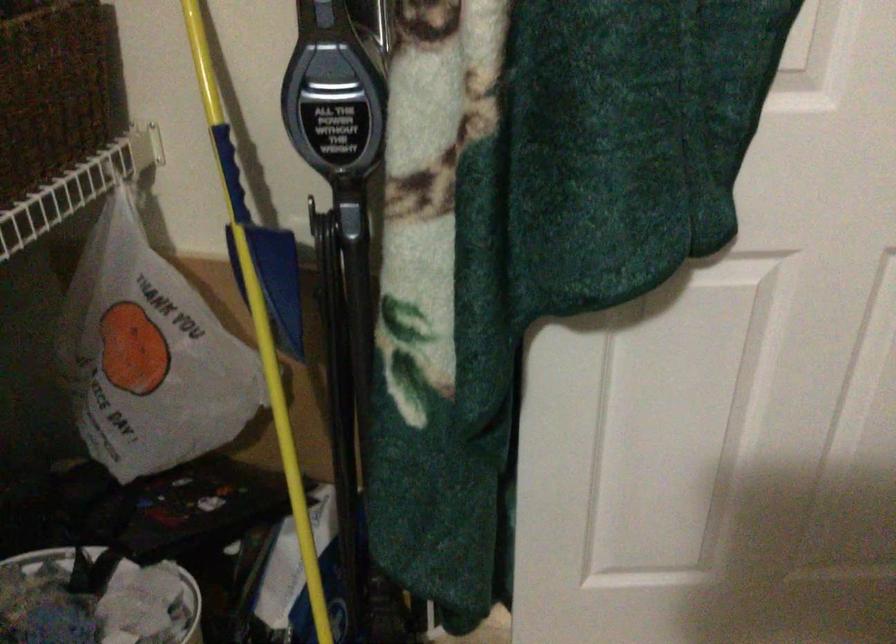
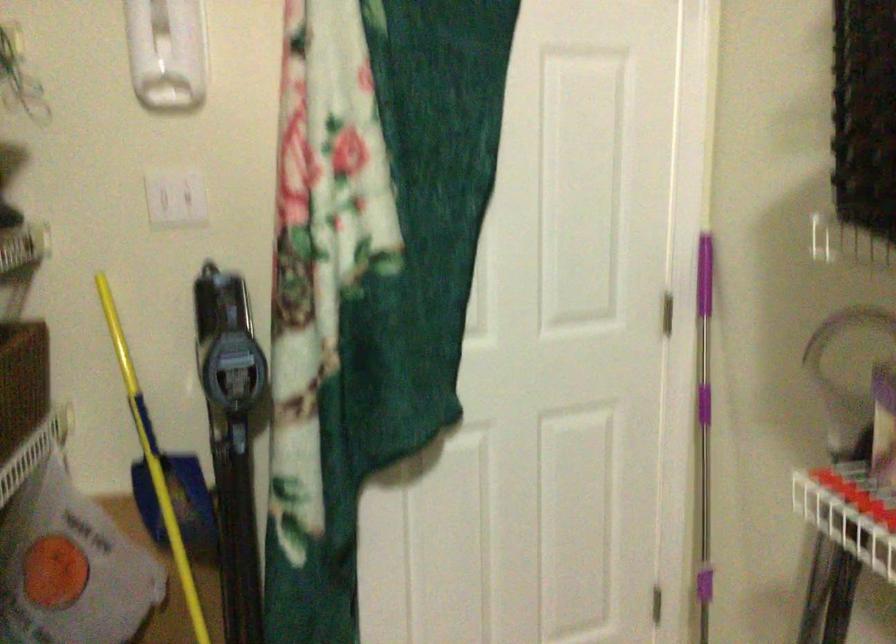
In a continuous first-person perspective shot, in which direction is the camera moving?

The movement direction of the cameraman is left, backward.